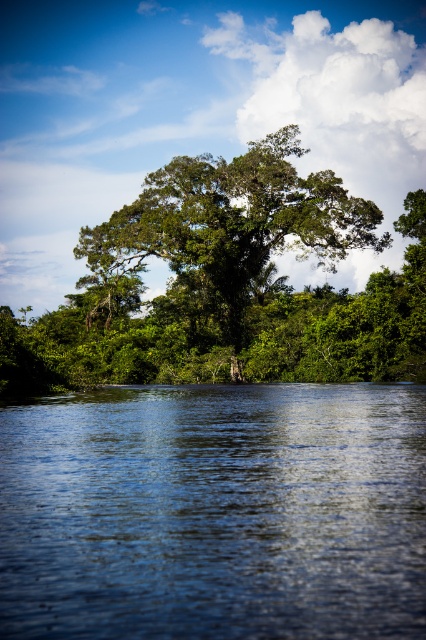
Question: Is blue liquid water at lower center above green leafy tree at center?

Choices:
 (A) yes
 (B) no

Answer: (B)

Question: Which object is closer to the camera taking this photo?

Choices:
 (A) green leafy tree at center
 (B) blue liquid water at lower center

Answer: (B)

Question: Which object appears closest to the camera in this image?

Choices:
 (A) blue liquid water at lower center
 (B) green leafy tree at center

Answer: (A)

Question: Which point is farther from the camera taking this photo?

Choices:
 (A) (238, 214)
 (B) (244, 515)

Answer: (A)

Question: Is blue liquid water at lower center positioned before green leafy tree at center?

Choices:
 (A) yes
 (B) no

Answer: (A)

Question: Is blue liquid water at lower center bigger than green leafy tree at center?

Choices:
 (A) yes
 (B) no

Answer: (B)